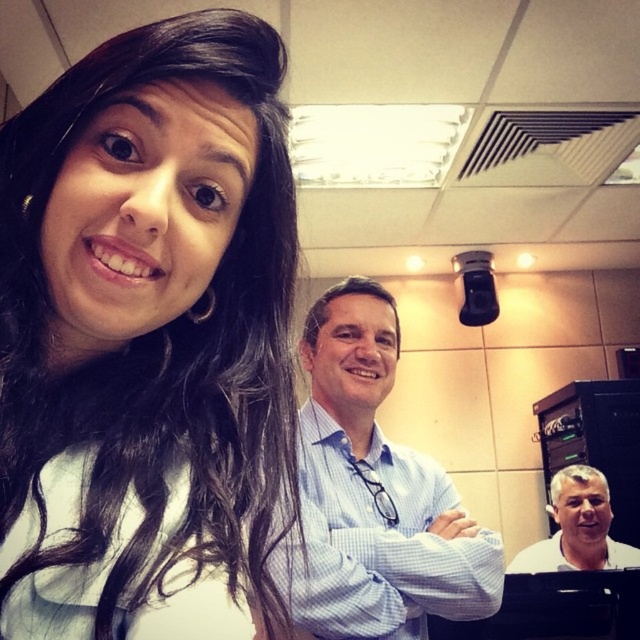
Question: Is light blue checkered shirt at center positioned behind white shirt at center?

Choices:
 (A) yes
 (B) no

Answer: (B)

Question: Does matte white shirt at upper left have a greater width compared to light blue checkered shirt at center?

Choices:
 (A) no
 (B) yes

Answer: (A)

Question: Does matte white shirt at upper left appear over white shirt at center?

Choices:
 (A) yes
 (B) no

Answer: (A)

Question: Which point is farther to the camera?

Choices:
 (A) (32, 525)
 (B) (326, 451)
 (C) (577, 545)

Answer: (C)

Question: Considering the real-world distances, which object is closest to the white shirt at center?

Choices:
 (A) matte white shirt at upper left
 (B) light blue checkered shirt at center

Answer: (B)

Question: Estimate the real-world distances between objects in this image. Which object is farther from the matte white shirt at upper left?

Choices:
 (A) light blue checkered shirt at center
 (B) white shirt at center

Answer: (B)